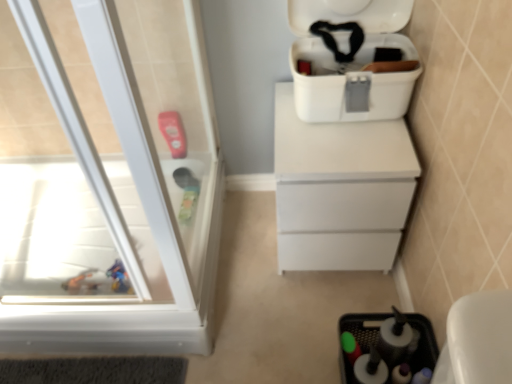
Question: Looking at their shapes, would you say black plastic sink at lower right is wider or thinner than white plastic cooler at upper right?

Choices:
 (A) thin
 (B) wide

Answer: (A)

Question: Relative to white plastic cooler at upper right, is black plastic sink at lower right in front or behind?

Choices:
 (A) front
 (B) behind

Answer: (B)

Question: Estimate the real-world distances between objects in this image. Which object is closer to the white plastic cooler at upper right?

Choices:
 (A) white matte chest of drawers at center
 (B) black plastic sink at lower right
 (C) transparent plastic screen door at left

Answer: (A)

Question: Which is nearer to the black plastic sink at lower right?

Choices:
 (A) white matte chest of drawers at center
 (B) transparent plastic screen door at left
 (C) white plastic cooler at upper right

Answer: (A)